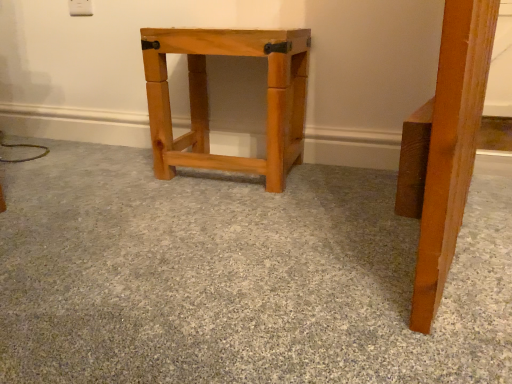
Identify the location of natural wood stool at center. (208, 104).

The image size is (512, 384). What do you see at coordinates (208, 104) in the screenshot? I see `natural wood stool at center` at bounding box center [208, 104].

At what (x,y) coordinates should I click in order to perform the action: click on natural wood table at center. Please return your answer as a coordinate pair (x, y). Image resolution: width=512 pixels, height=384 pixels. Looking at the image, I should click on (238, 277).

Describe the element at coordinates (238, 277) in the screenshot. I see `natural wood table at center` at that location.

Where is `natural wood stool at center`? Image resolution: width=512 pixels, height=384 pixels. natural wood stool at center is located at coordinates (208, 104).

Is natural wood table at center at the right side of natural wood stool at center?

No.

Considering their positions, is natural wood table at center located in front of or behind natural wood stool at center?

Visually, natural wood table at center is located in front of natural wood stool at center.

Which is closer, (27, 347) or (152, 100)?

Point (27, 347) is positioned closer to the camera compared to point (152, 100).

From the image's perspective, which object appears higher, natural wood table at center or natural wood stool at center?

natural wood stool at center, from the image's perspective.

From a real-world perspective, between natural wood table at center and natural wood stool at center, who is vertically higher?

natural wood stool at center is physically above.

Considering the relative sizes of natural wood table at center and natural wood stool at center in the image provided, is natural wood table at center wider than natural wood stool at center?

Yes.

Does natural wood table at center have a greater height compared to natural wood stool at center?

Incorrect, the height of natural wood table at center is not larger of that of natural wood stool at center.

Does natural wood table at center have a smaller size compared to natural wood stool at center?

Incorrect, natural wood table at center is not smaller in size than natural wood stool at center.

Would you say natural wood table at center is inside or outside natural wood stool at center?

natural wood table at center lies outside natural wood stool at center.

Is natural wood table at center far from natural wood stool at center?

That's not correct — natural wood table at center is a little close to natural wood stool at center.

Is natural wood table at center looking in the opposite direction of natural wood stool at center?

No, natural wood table at center's orientation is not away from natural wood stool at center.

How many degrees apart are the facing directions of natural wood table at center and natural wood stool at center?

The angular difference between natural wood table at center and natural wood stool at center is 180 degrees.

I want to click on stool above the natural wood table at center (from a real-world perspective), so click(x=208, y=104).

Considering the relative positions of natural wood stool at center and natural wood table at center in the image provided, is natural wood stool at center to the left of natural wood table at center from the viewer's perspective?

No, natural wood stool at center is not to the left of natural wood table at center.

Considering the positions of objects natural wood stool at center and natural wood table at center in the image provided, who is in front, natural wood stool at center or natural wood table at center?

natural wood table at center is closer to the camera.

Considering the points (284, 91) and (96, 372), which point is behind, point (284, 91) or point (96, 372)?

The point (284, 91) is farther from the camera.

In the scene shown: From the image's perspective, is natural wood stool at center above or below natural wood table at center?

Based on their image positions, natural wood stool at center is located above natural wood table at center.

From a real-world perspective, is natural wood stool at center positioned under natural wood table at center based on gravity?

Actually, natural wood stool at center is physically above natural wood table at center in the real world.

In terms of width, does natural wood stool at center look wider or thinner when compared to natural wood table at center?

Considering their sizes, natural wood stool at center looks slimmer than natural wood table at center.

Is natural wood stool at center taller or shorter than natural wood table at center?

Clearly, natural wood stool at center is taller compared to natural wood table at center.

Can you confirm if natural wood stool at center is bigger than natural wood table at center?

No.

Would you say natural wood table at center is part of natural wood stool at center's contents?

No, natural wood stool at center does not contain natural wood table at center.

Is there a large distance between natural wood stool at center and natural wood table at center?

natural wood stool at center is near natural wood table at center, not far away.

Is natural wood stool at center looking in the opposite direction of natural wood table at center?

No, natural wood stool at center's orientation is not away from natural wood table at center.

Consider the image. How different are the orientations of natural wood stool at center and natural wood table at center in degrees?

There is a 180-degree angle between the facing directions of natural wood stool at center and natural wood table at center.

You are a GUI agent. You are given a task and a screenshot of the screen. Output one action in this format:
    pyautogui.click(x=<x>, y=<y>)
    Task: Click on the concrete that appears in front of the natural wood stool at center
    
    Given the screenshot: What is the action you would take?
    pyautogui.click(x=238, y=277)

Locate an element on the screen. This screenshot has width=512, height=384. concrete below the natural wood stool at center (from a real-world perspective) is located at coordinates (238, 277).

This screenshot has height=384, width=512. Identify the location of concrete on the left of natural wood stool at center. (238, 277).